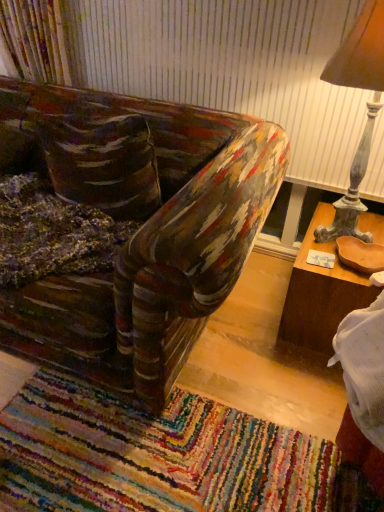
Question: Is wooden lampshade at right facing towards brown wood table at right?

Choices:
 (A) yes
 (B) no

Answer: (B)

Question: Is wooden lampshade at right closer to camera compared to brown wood table at right?

Choices:
 (A) no
 (B) yes

Answer: (B)

Question: Would you say wooden lampshade at right is outside brown wood table at right?

Choices:
 (A) yes
 (B) no

Answer: (A)

Question: Is the depth of wooden lampshade at right greater than that of brown wood table at right?

Choices:
 (A) yes
 (B) no

Answer: (B)

Question: Does wooden lampshade at right appear on the left side of brown wood table at right?

Choices:
 (A) no
 (B) yes

Answer: (B)

Question: Considering the relative sizes of wooden lampshade at right and brown wood table at right in the image provided, is wooden lampshade at right bigger than brown wood table at right?

Choices:
 (A) yes
 (B) no

Answer: (A)

Question: Is multicolored woven mat at lower center aimed at wooden lampshade at right?

Choices:
 (A) no
 (B) yes

Answer: (A)

Question: Can you confirm if multicolored woven mat at lower center is wider than wooden lampshade at right?

Choices:
 (A) yes
 (B) no

Answer: (A)

Question: Are multicolored woven mat at lower center and wooden lampshade at right located far from each other?

Choices:
 (A) no
 (B) yes

Answer: (B)

Question: From the image's perspective, does multicolored woven mat at lower center appear lower than wooden lampshade at right?

Choices:
 (A) yes
 (B) no

Answer: (A)

Question: Is multicolored woven mat at lower center positioned before wooden lampshade at right?

Choices:
 (A) no
 (B) yes

Answer: (B)

Question: From a real-world perspective, is multicolored woven mat at lower center on wooden lampshade at right?

Choices:
 (A) yes
 (B) no

Answer: (B)

Question: Could you tell me if multicolored woven mat at lower center is facing brown wood table at right?

Choices:
 (A) no
 (B) yes

Answer: (A)